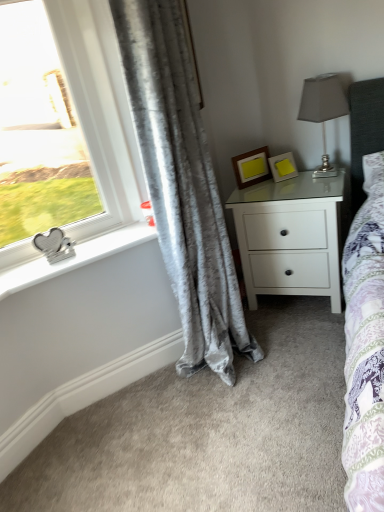
Image resolution: width=384 pixels, height=512 pixels. Identify the location of vacant region in front of yellow matte picture frame at upper right, the first picture frame from the right. (296, 187).